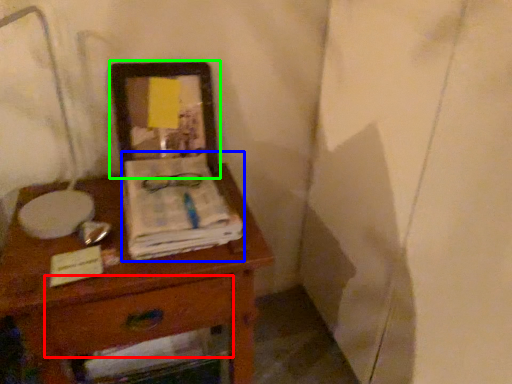
Question: Based on their relative distances, which object is nearer to drawer (highlighted by a red box)? Choose from magazine (highlighted by a blue box) and picture frame (highlighted by a green box).

Choices:
 (A) magazine
 (B) picture frame

Answer: (A)